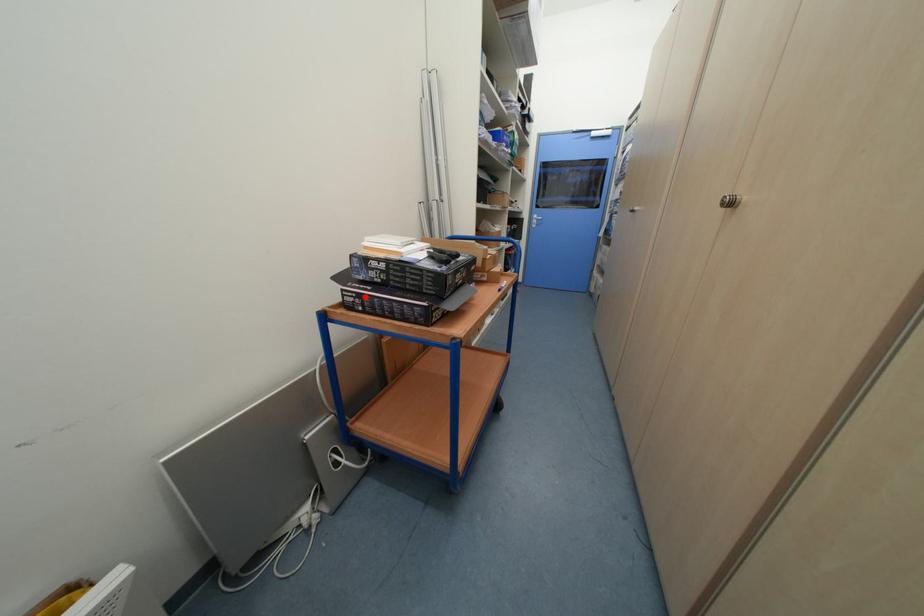
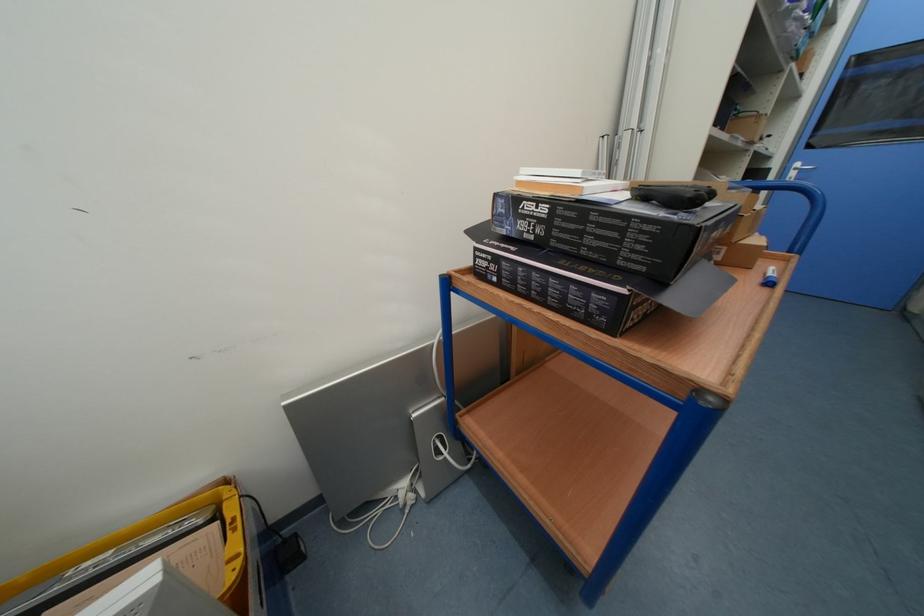
Find the pixel in the second image that matches the highlighted location in the first image.

(502, 261)